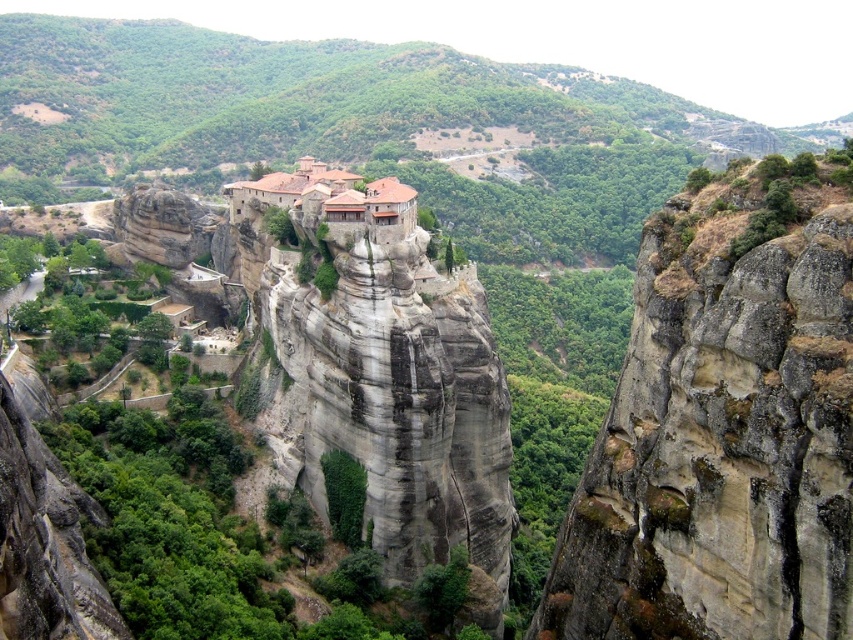
From the picture: You are a hiker standing at the base of the cliff looking up at the gray rocky cliff at upper right and the brown clay roof at center. Which object is positioned to the right of the other?

The gray rocky cliff at upper right is positioned to the right of the brown clay roof at center.

Consider the image. You are a hiker standing at the base of the cliff looking up at the monastic complex. You notice two points marked on the cliff face. The first point is at coordinates point (711, 356) and the second is at point (244, 204). Which of these two points is closer to you?

Point (244, 204) is closer to you because it is behind point (711, 356), meaning the latter is further away from your vantage point at the base of the cliff.

You are standing at the base of the cliff looking up at the monastic complex. There is a specific point marked at coordinates point (822, 289). If you want to reach this point using a ladder, how long should the ladder be?

The point (822, 289) is 57.96 meters away from the camera, so the ladder should be at least 57.96 meters long to reach it.